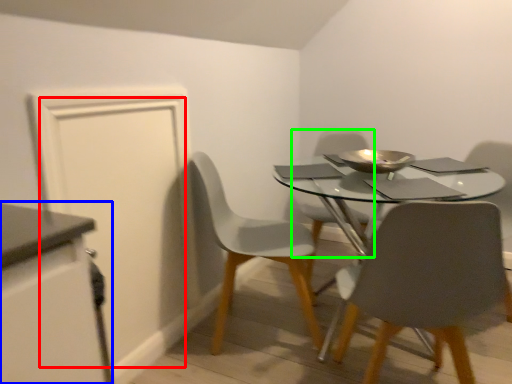
Question: Which object is positioned farthest from door (highlighted by a red box)? Select from cabinetry (highlighted by a blue box) and chair (highlighted by a green box).

Choices:
 (A) cabinetry
 (B) chair

Answer: (B)